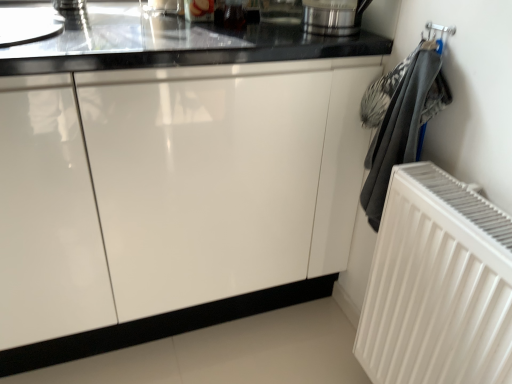
Question: Is polished stainless steel kettle at upper right smaller than glossy white cabinet at center?

Choices:
 (A) no
 (B) yes

Answer: (B)

Question: Is polished stainless steel kettle at upper right not close to glossy white cabinet at center?

Choices:
 (A) yes
 (B) no

Answer: (B)

Question: Can you confirm if polished stainless steel kettle at upper right is thinner than glossy white cabinet at center?

Choices:
 (A) yes
 (B) no

Answer: (A)

Question: Is the depth of polished stainless steel kettle at upper right greater than that of glossy white cabinet at center?

Choices:
 (A) yes
 (B) no

Answer: (A)

Question: Considering the relative positions of polished stainless steel kettle at upper right and glossy white cabinet at center in the image provided, is polished stainless steel kettle at upper right to the left of glossy white cabinet at center from the viewer's perspective?

Choices:
 (A) no
 (B) yes

Answer: (A)

Question: Does polished stainless steel kettle at upper right touch glossy white cabinet at center?

Choices:
 (A) yes
 (B) no

Answer: (B)

Question: Are glossy white cabinet at center and polished stainless steel kettle at upper right making contact?

Choices:
 (A) yes
 (B) no

Answer: (B)

Question: Does glossy white cabinet at center have a greater width compared to polished stainless steel kettle at upper right?

Choices:
 (A) yes
 (B) no

Answer: (A)

Question: Is glossy white cabinet at center aimed at polished stainless steel kettle at upper right?

Choices:
 (A) no
 (B) yes

Answer: (A)

Question: Considering the relative sizes of glossy white cabinet at center and polished stainless steel kettle at upper right in the image provided, is glossy white cabinet at center taller than polished stainless steel kettle at upper right?

Choices:
 (A) no
 (B) yes

Answer: (B)

Question: Is glossy white cabinet at center bigger than polished stainless steel kettle at upper right?

Choices:
 (A) no
 (B) yes

Answer: (B)

Question: Can you confirm if glossy white cabinet at center is shorter than polished stainless steel kettle at upper right?

Choices:
 (A) no
 (B) yes

Answer: (A)

Question: From a real-world perspective, is white ribbed radiator at right physically above polished stainless steel kettle at upper right?

Choices:
 (A) no
 (B) yes

Answer: (A)